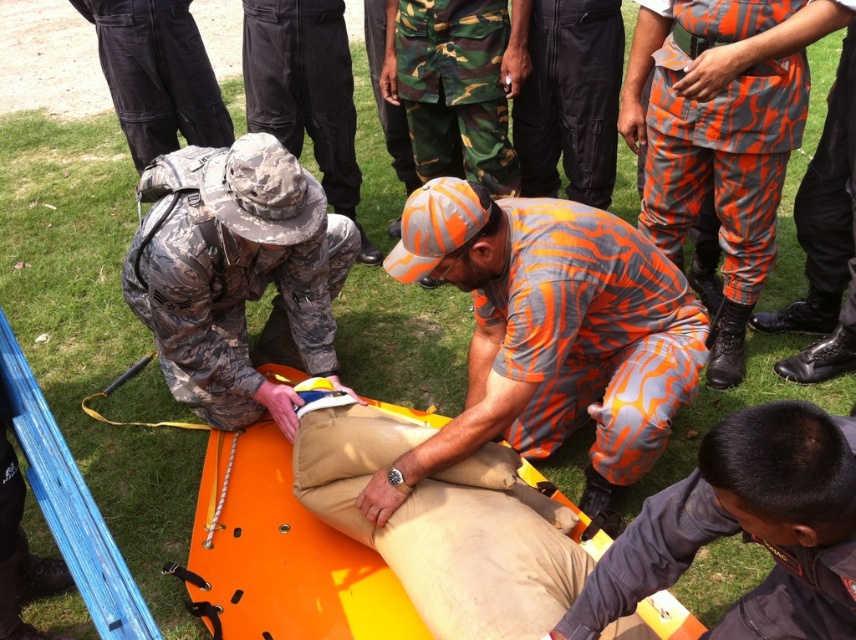
Question: Does dark gray smooth uniform at lower right have a larger size compared to camouflage fabric hat at upper left?

Choices:
 (A) yes
 (B) no

Answer: (B)

Question: Which point is closer to the camera?

Choices:
 (A) (x=852, y=252)
 (B) (x=724, y=625)
 (C) (x=685, y=28)

Answer: (B)

Question: Is orange camouflage pants at center further to the viewer compared to black cotton pants at center?

Choices:
 (A) yes
 (B) no

Answer: (B)

Question: In this image, where is orange camouflage uniform at center located relative to dark gray smooth uniform at lower right?

Choices:
 (A) left
 (B) right

Answer: (A)

Question: Which object is positioned farthest from the dark gray smooth uniform at lower right?

Choices:
 (A) camouflage fabric uniform at upper left
 (B) orange camouflage uniform at center
 (C) orange camouflage pants at right

Answer: (A)

Question: Which object appears closest to the camera in this image?

Choices:
 (A) orange camouflage pants at right
 (B) dark gray smooth uniform at lower right

Answer: (B)